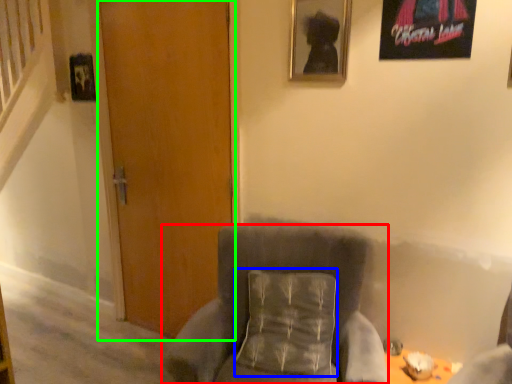
Question: Which object is the closest to the chair (highlighted by a red box)? Choose among these: pillow (highlighted by a blue box) or door (highlighted by a green box).

Choices:
 (A) pillow
 (B) door

Answer: (A)